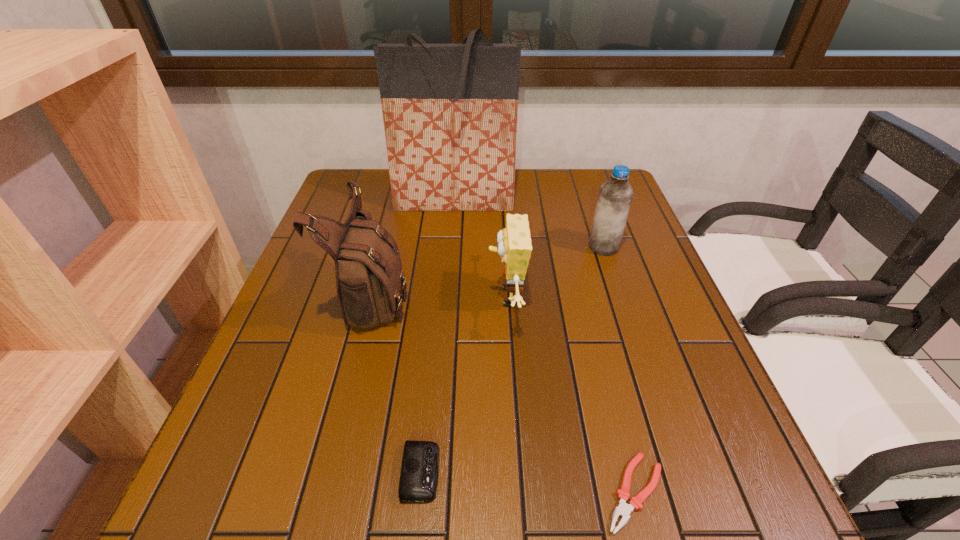
Locate an element on the screen. This screenshot has width=960, height=540. vacant space that satisfies the following two spatial constraints: 1. on the front-facing side of the shoulder bag; 2. on the right side of the shortest object is located at coordinates (324, 492).